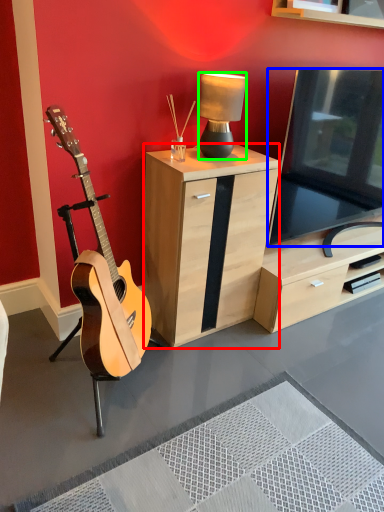
Question: Based on their relative distances, which object is nearer to cabinetry (highlighted by a red box)? Choose from television (highlighted by a blue box) and lamp (highlighted by a green box).

Choices:
 (A) television
 (B) lamp

Answer: (B)